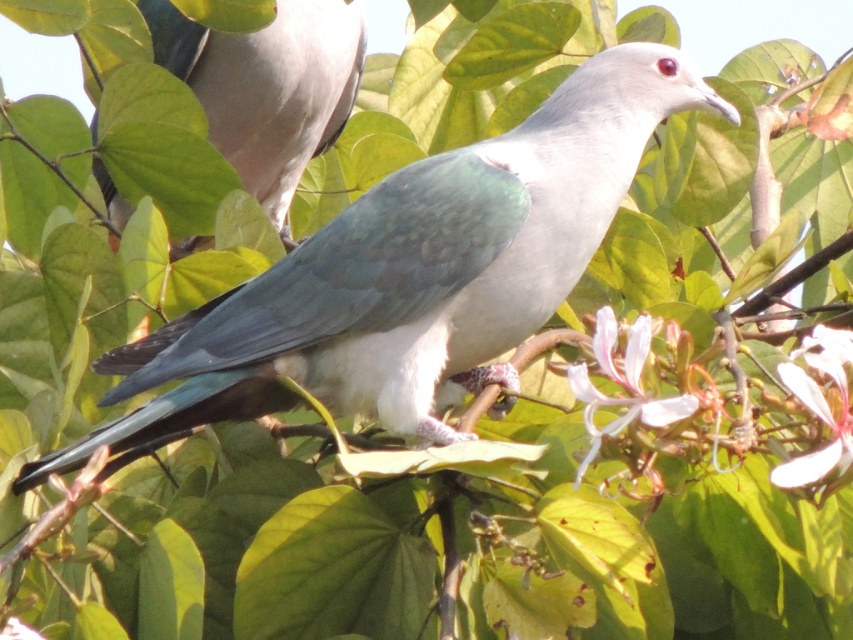
Does matte green bird at center have a larger size compared to matte gray dove at upper left?

Yes, matte green bird at center is bigger than matte gray dove at upper left.

Is matte green bird at center smaller than matte gray dove at upper left?

Incorrect, matte green bird at center is not smaller in size than matte gray dove at upper left.

Does point (325, 388) lie in front of point (291, 92)?

Yes, point (325, 388) is closer to viewer.

Locate an element on the screen. matte green bird at center is located at coordinates (410, 275).